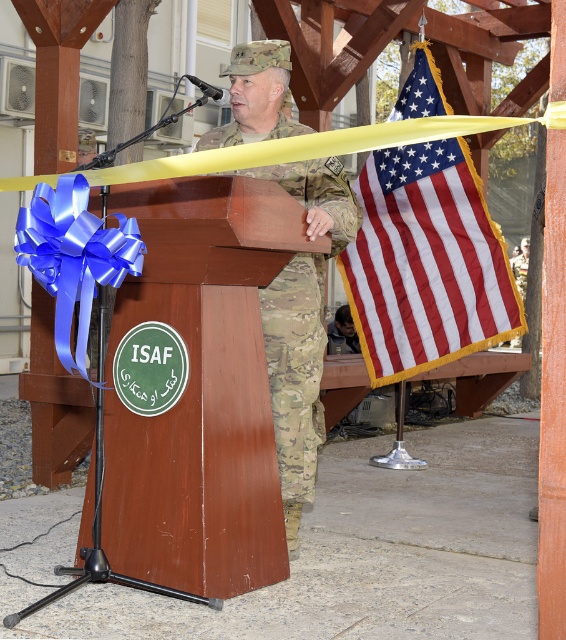
Is point (366, 200) positioned in front of point (269, 296)?

That is False.

Does red-white striped flag at upper right come behind camouflage fabric uniform at center?

Yes, it is.

Is point (422, 330) positioned before point (294, 124)?

No, it is behind (294, 124).

Image resolution: width=566 pixels, height=640 pixels. In order to click on red-white striped flag at upper right in this screenshot , I will do `click(426, 262)`.

Does brown wood podium at center have a larger size compared to red-white striped flag at upper right?

No, brown wood podium at center is not bigger than red-white striped flag at upper right.

Does point (263, 202) come farther from viewer compared to point (422, 145)?

No, it is in front of (422, 145).

Locate an element on the screen. brown wood podium at center is located at coordinates (200, 390).

Is brown wood podium at center positioned before camouflage fabric uniform at center?

Yes.

Who is more distant from viewer, (199,362) or (301,419)?

Positioned behind is point (301,419).

Which is behind, point (247, 246) or point (293, 323)?

The point (293, 323) is more distant.

At what (x,y) coordinates should I click in order to perform the action: click on brown wood podium at center. Please return your answer as a coordinate pair (x, y). The height and width of the screenshot is (640, 566). Looking at the image, I should click on (200, 390).